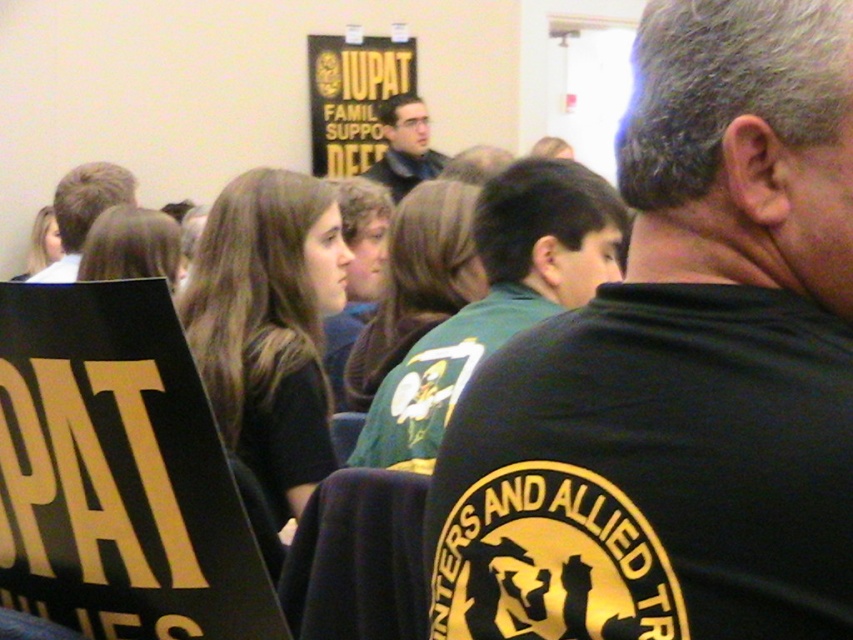
Question: Which is nearer to the green jersey at center?

Choices:
 (A) black t-shirt at upper right
 (B) dark brown leather jacket at upper center
 (C) blonde hair at left

Answer: (A)

Question: Does black t-shirt at upper right appear under blonde hair at left?

Choices:
 (A) no
 (B) yes

Answer: (B)

Question: Can you confirm if blonde hair at left is wider than dark brown leather jacket at upper center?

Choices:
 (A) yes
 (B) no

Answer: (A)

Question: Which point is closer to the camera taking this photo?

Choices:
 (A) pyautogui.click(x=409, y=172)
 (B) pyautogui.click(x=572, y=204)
 (C) pyautogui.click(x=538, y=435)

Answer: (C)

Question: Is green jersey at center thinner than blonde hair at left?

Choices:
 (A) no
 (B) yes

Answer: (A)

Question: Among these objects, which one is nearest to the camera?

Choices:
 (A) black t-shirt at upper right
 (B) dark brown leather jacket at upper center
 (C) blonde hair at left
 (D) green jersey at center

Answer: (A)